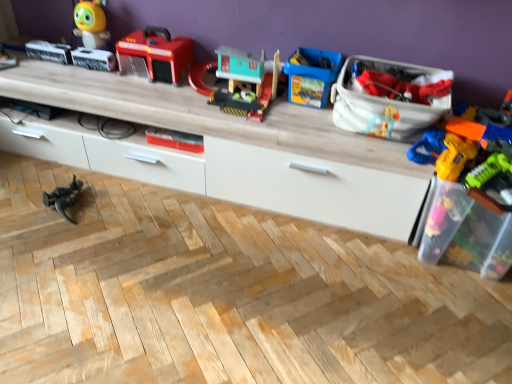
Where is `unoccupied space behind black plastic dinosaur at lower left, the 7th toy from the right`? The image size is (512, 384). unoccupied space behind black plastic dinosaur at lower left, the 7th toy from the right is located at coordinates tap(81, 175).